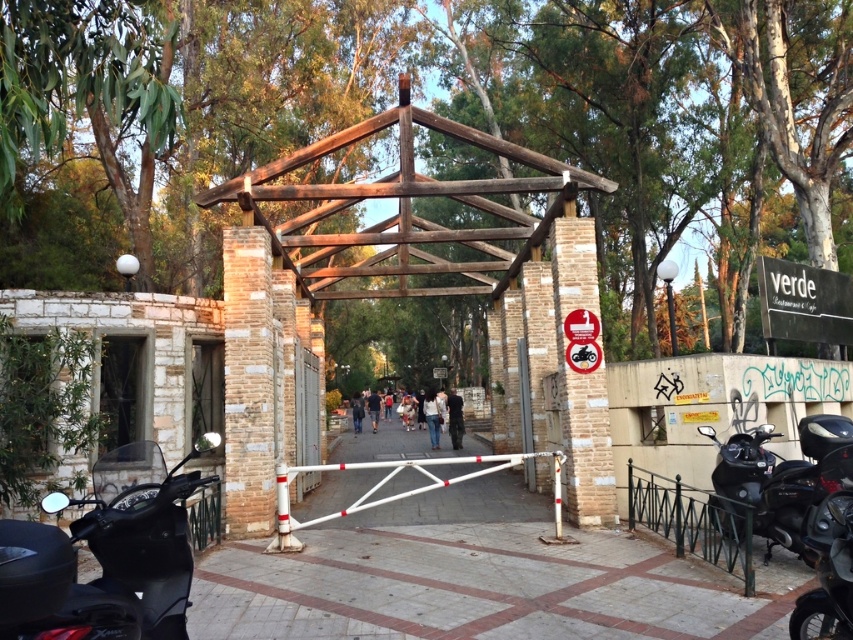
Question: Can you confirm if black matte motorcycle at lower left is positioned to the left of black glossy motorcycle at lower right?

Choices:
 (A) no
 (B) yes

Answer: (B)

Question: Which point is farther to the camera?

Choices:
 (A) shiny black motorcycle at lower right
 (B) black glossy motorcycle at lower right

Answer: (B)

Question: Is black glossy motorcycle at lower right below shiny black motorcycle at lower right?

Choices:
 (A) yes
 (B) no

Answer: (B)

Question: Which point is farther to the camera?

Choices:
 (A) shiny black motorcycle at lower right
 (B) black glossy motorcycle at lower right

Answer: (B)

Question: Is the position of black glossy motorcycle at lower right more distant than that of shiny black motorcycle at lower right?

Choices:
 (A) no
 (B) yes

Answer: (B)

Question: Which of these objects is positioned closest to the shiny black motorcycle at lower right?

Choices:
 (A) black glossy motorcycle at lower right
 (B) black matte motorcycle at lower left

Answer: (A)